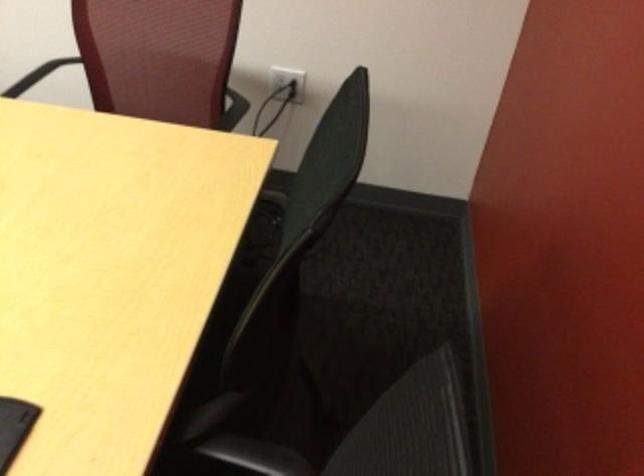
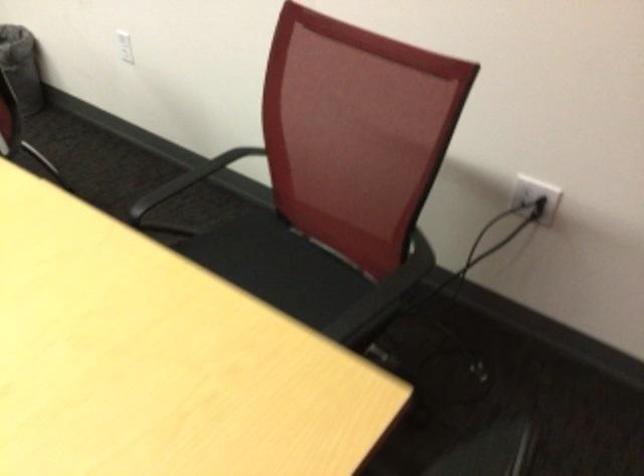
Question: Based on the continuous images, in which direction is the camera rotating? Reply with the corresponding letter.

Choices:
 (A) Left
 (B) Right
 (C) Up
 (D) Down

Answer: (A)